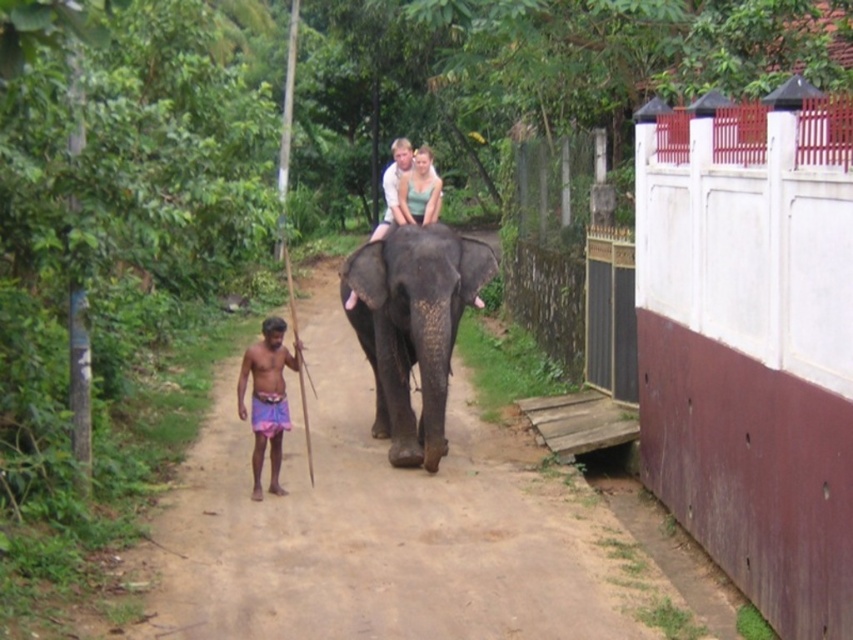
You are a traveler walking on the brown dirt path at center and want to reach the dark gray textured elephant at center. Can you walk straight ahead on the path to reach it?

The brown dirt path at center is in front of dark gray textured elephant at center, so yes, you can walk straight ahead on the path to reach it since the path is directly in front of the elephant.

You are a photographer trying to capture a clear photo of both the pink fabric shorts at lower center and the green textured top at center. Based on their positions, which one should you focus on first to ensure both are in frame?

The pink fabric shorts at lower center is taller than the green textured top at center, so focusing on the pink fabric shorts at lower center first will ensure both are in frame as the taller object will occupy more space and help frame the composition.

You are a photographer standing at the starting point of the dirt path. You want to capture a photo of both the pink fabric shorts at lower center and the green textured top at center in the same frame. Given that your camera has a maximum zoom range of 2 meters, can you fit both subjects into the frame without moving closer?

The distance between the pink fabric shorts at lower center and the green textured top at center is 2.22 meters. Since the camera can only zoom up to 2 meters, the photographer cannot fit both subjects into the frame without moving closer.